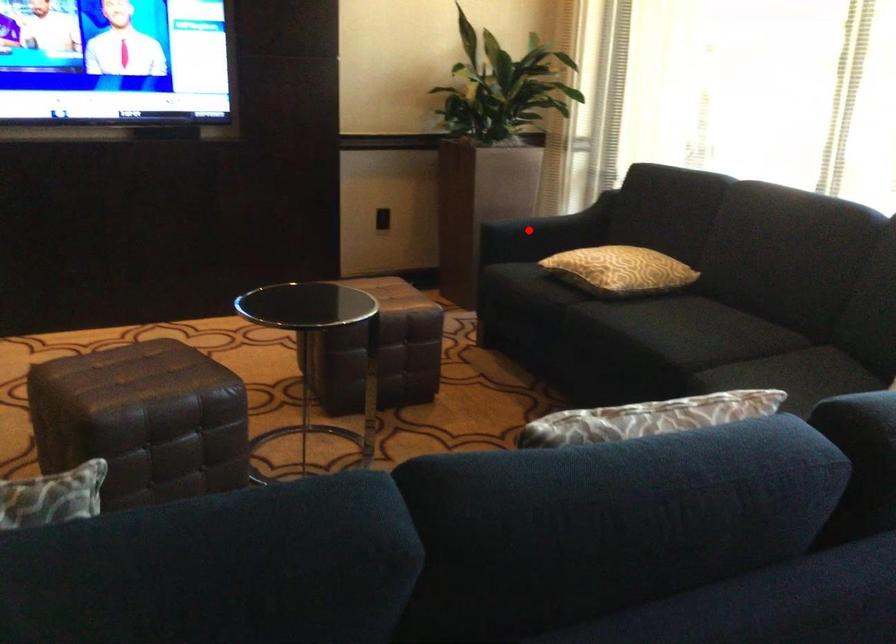
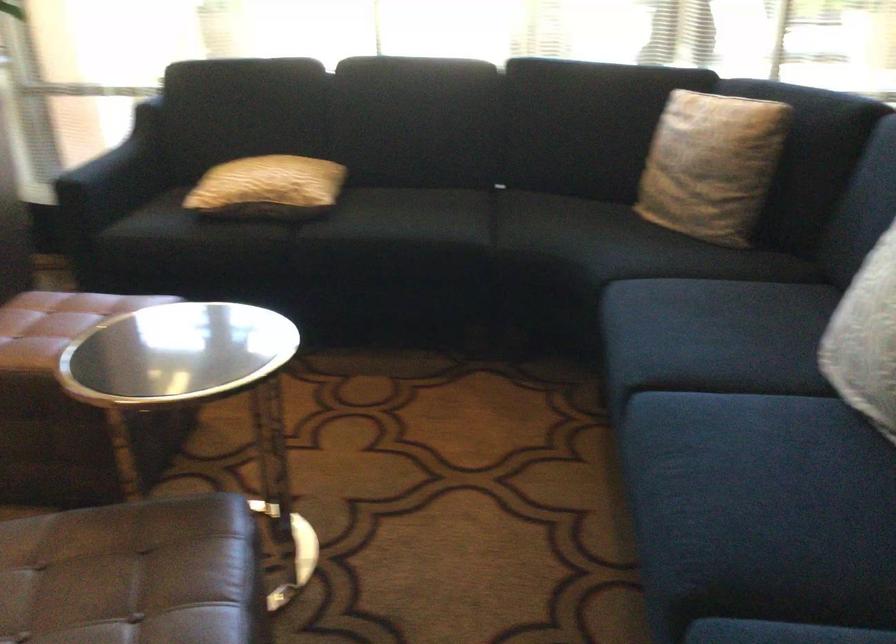
Question: I am providing you with two images of the same scene from different viewpoints. In image1, a red point is highlighted. Considering the same 3D point in image2, which of the following is correct?

Choices:
 (A) It is closer
 (B) It is farther

Answer: (A)